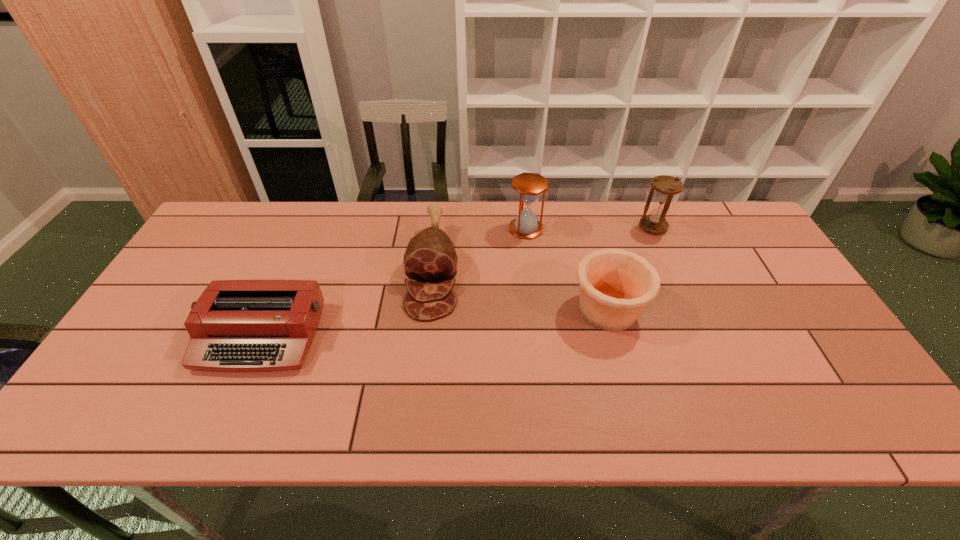
At what (x,y) coordinates should I click in order to perform the action: click on free location located 0.090m on the typing side of the typewriter. Please return your answer as a coordinate pair (x, y). Image resolution: width=960 pixels, height=540 pixels. Looking at the image, I should click on (228, 411).

Where is `ham that is at the far edge`? The height and width of the screenshot is (540, 960). ham that is at the far edge is located at coordinates (430, 257).

The width and height of the screenshot is (960, 540). I want to click on free space at the far edge, so click(296, 207).

Locate an element on the screen. vacant space at the near edge is located at coordinates (536, 403).

Identify the location of blank area at the left edge. (113, 392).

Identify the location of vacant region at the right edge of the desktop. (753, 288).

The image size is (960, 540). I want to click on free space at the far left corner of the desktop, so click(x=202, y=239).

Locate an element on the screen. blank space at the near right corner is located at coordinates (849, 403).

This screenshot has width=960, height=540. Identify the location of unoccupied area between the pottery and the third object from left to right. (567, 269).

The width and height of the screenshot is (960, 540). Find the location of `vacant area that lies between the ham and the pottery`. vacant area that lies between the ham and the pottery is located at coordinates (520, 289).